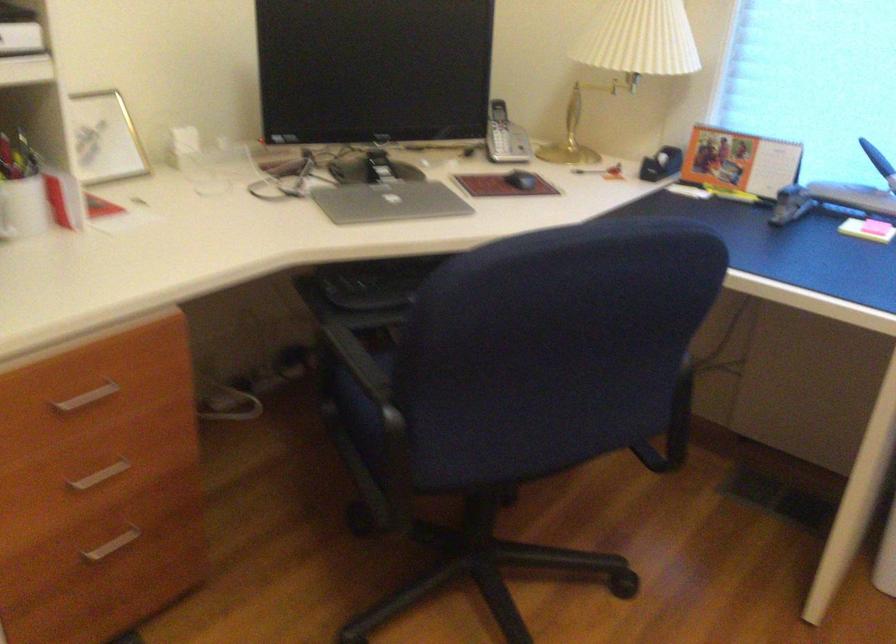
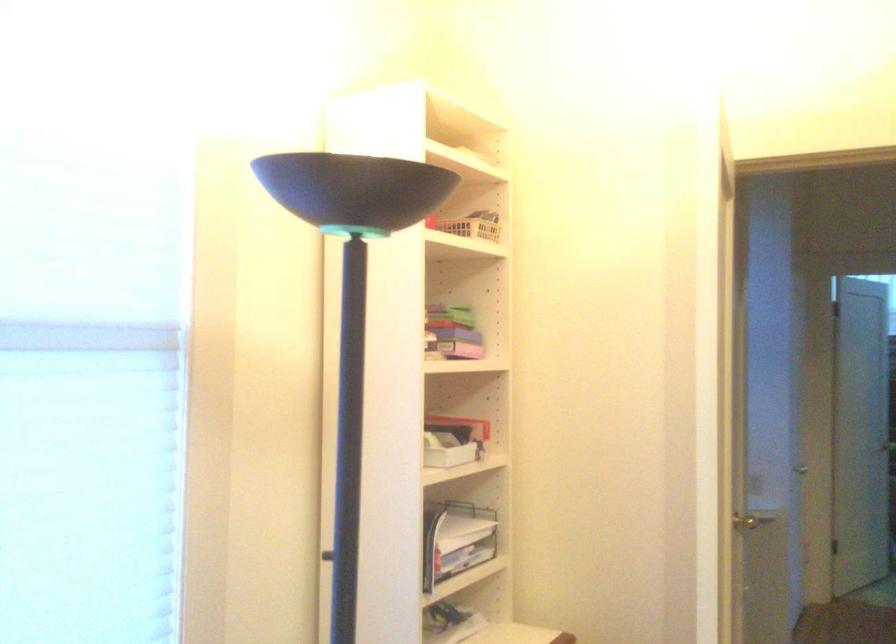
Question: How did the camera likely rotate?

Choices:
 (A) Left
 (B) Right
 (C) Up
 (D) Down

Answer: (B)